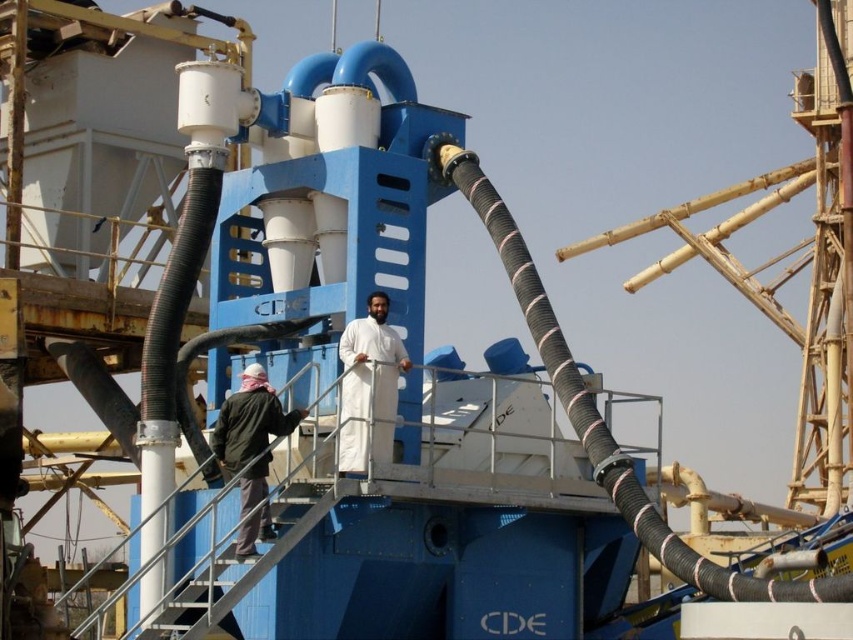
Question: Does white matte clothing at center have a larger size compared to dark green jacket at lower left?

Choices:
 (A) no
 (B) yes

Answer: (B)

Question: Where is white matte clothing at center located in relation to dark green jacket at lower left in the image?

Choices:
 (A) below
 (B) above

Answer: (B)

Question: Is white matte clothing at center further to camera compared to dark green jacket at lower left?

Choices:
 (A) no
 (B) yes

Answer: (B)

Question: Which object appears closest to the camera in this image?

Choices:
 (A) dark green jacket at lower left
 (B) white matte clothing at center

Answer: (A)

Question: Which point appears closest to the camera in this image?

Choices:
 (A) (381, 296)
 (B) (238, 444)

Answer: (B)